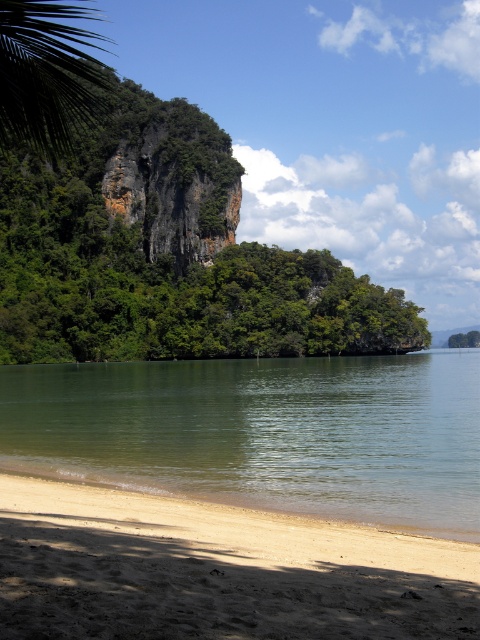
Question: Does green smooth water at lower left appear over green leafy palm tree at upper left?

Choices:
 (A) yes
 (B) no

Answer: (B)

Question: Which of the following is the closest to the observer?

Choices:
 (A) light brown sandy beach at lower left
 (B) green leafy palm tree at upper left
 (C) green smooth water at lower left

Answer: (A)

Question: Is green smooth water at lower left closer to camera compared to light brown sandy beach at lower left?

Choices:
 (A) no
 (B) yes

Answer: (A)

Question: Can you confirm if green smooth water at lower left is positioned below light brown sandy beach at lower left?

Choices:
 (A) yes
 (B) no

Answer: (A)

Question: Among these points, which one is nearest to the camera?

Choices:
 (A) (467, 545)
 (B) (33, 99)
 (C) (154, 484)

Answer: (B)

Question: Which object is positioned closest to the green smooth water at lower left?

Choices:
 (A) light brown sandy beach at lower left
 (B) green leafy palm tree at upper left

Answer: (A)